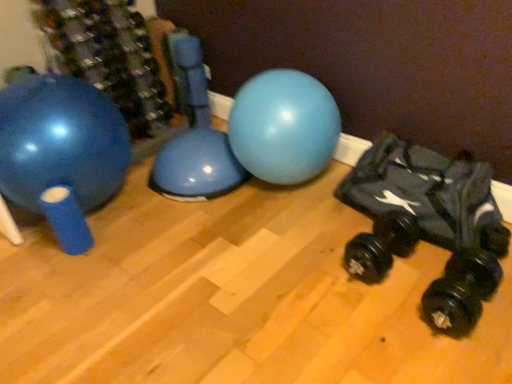
Question: From a real-world perspective, does black rubber dumbbell at lower right, the 1th dumbbell when ordered from right to left, stand above matte blue exercise ball at left?

Choices:
 (A) no
 (B) yes

Answer: (A)

Question: Is black rubber dumbbell at lower right, the 1th dumbbell when ordered from right to left, taller than matte blue exercise ball at left?

Choices:
 (A) no
 (B) yes

Answer: (A)

Question: Is black rubber dumbbell at lower right, which is counted as the second dumbbell, starting from the left, positioned with its back to matte blue exercise ball at left?

Choices:
 (A) yes
 (B) no

Answer: (B)

Question: Does black rubber dumbbell at lower right, which is counted as the second dumbbell, starting from the left, come behind matte blue exercise ball at left?

Choices:
 (A) no
 (B) yes

Answer: (A)

Question: Considering the relative sizes of black rubber dumbbell at lower right, the 1th dumbbell when ordered from right to left, and matte blue exercise ball at left in the image provided, is black rubber dumbbell at lower right, the 1th dumbbell when ordered from right to left, bigger than matte blue exercise ball at left?

Choices:
 (A) yes
 (B) no

Answer: (B)

Question: Does black rubber dumbbell at lower right, the 1th dumbbell when ordered from right to left, have a lesser width compared to matte blue exercise ball at left?

Choices:
 (A) no
 (B) yes

Answer: (B)

Question: From a real-world perspective, is black rubber dumbbell at lower right, arranged as the first dumbbell when viewed from the left, located beneath matte blue exercise ball at left?

Choices:
 (A) no
 (B) yes

Answer: (B)

Question: From the image's perspective, is black rubber dumbbell at lower right, arranged as the first dumbbell when viewed from the left, below matte blue exercise ball at left?

Choices:
 (A) no
 (B) yes

Answer: (B)

Question: Can we say black rubber dumbbell at lower right, arranged as the first dumbbell when viewed from the left, lies outside matte blue exercise ball at left?

Choices:
 (A) no
 (B) yes

Answer: (B)

Question: Considering the relative positions of black rubber dumbbell at lower right, arranged as the first dumbbell when viewed from the left, and matte blue exercise ball at left in the image provided, is black rubber dumbbell at lower right, arranged as the first dumbbell when viewed from the left, to the right of matte blue exercise ball at left from the viewer's perspective?

Choices:
 (A) yes
 (B) no

Answer: (A)

Question: Is black rubber dumbbell at lower right, arranged as the first dumbbell when viewed from the left, smaller than matte blue exercise ball at left?

Choices:
 (A) yes
 (B) no

Answer: (A)

Question: From the image's perspective, is black rubber dumbbell at lower right, arranged as the first dumbbell when viewed from the left, above matte blue exercise ball at left?

Choices:
 (A) yes
 (B) no

Answer: (B)

Question: Is black rubber dumbbell at lower right, which is counted as the second dumbbell, starting from the left, oriented away from black rubber dumbbell at lower right, arranged as the first dumbbell when viewed from the left?

Choices:
 (A) no
 (B) yes

Answer: (A)